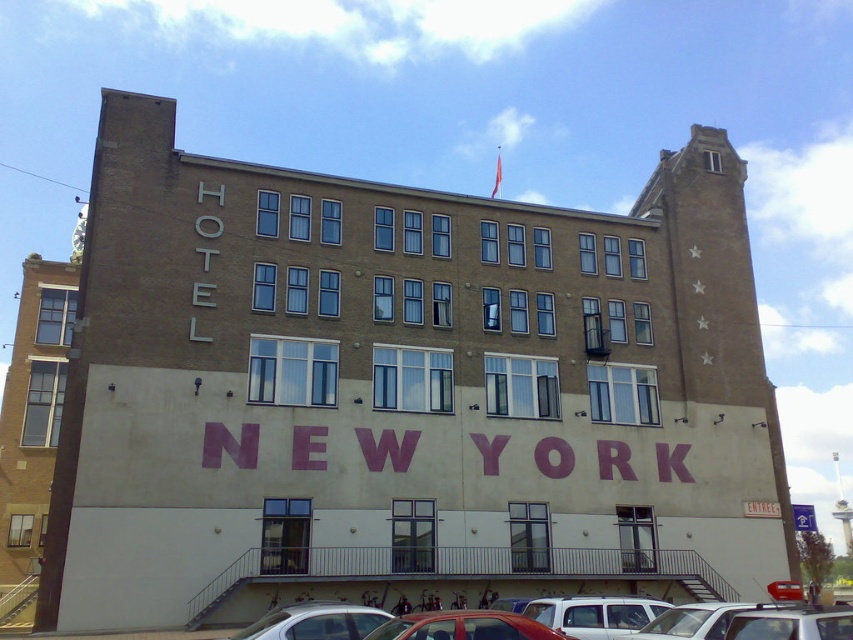
Question: Which point is farther from the camera taking this photo?

Choices:
 (A) (718, 616)
 (B) (322, 634)
 (C) (397, 637)

Answer: (B)

Question: Observing the image, what is the correct spatial positioning of shiny red car at center in reference to white matte van at center?

Choices:
 (A) right
 (B) left

Answer: (B)

Question: Is beige brick building at left to the left of white matte van at center from the viewer's perspective?

Choices:
 (A) no
 (B) yes

Answer: (B)

Question: Which of the following is the farthest from the observer?

Choices:
 (A) (384, 618)
 (B) (635, 618)
 (C) (759, 625)
 (D) (9, 556)

Answer: (D)

Question: Does shiny red car at center appear over white matte van at center?

Choices:
 (A) no
 (B) yes

Answer: (B)

Question: Which point is closer to the camera taking this photo?

Choices:
 (A) (6, 624)
 (B) (341, 618)
 (C) (811, 620)
 (D) (547, 630)

Answer: (C)